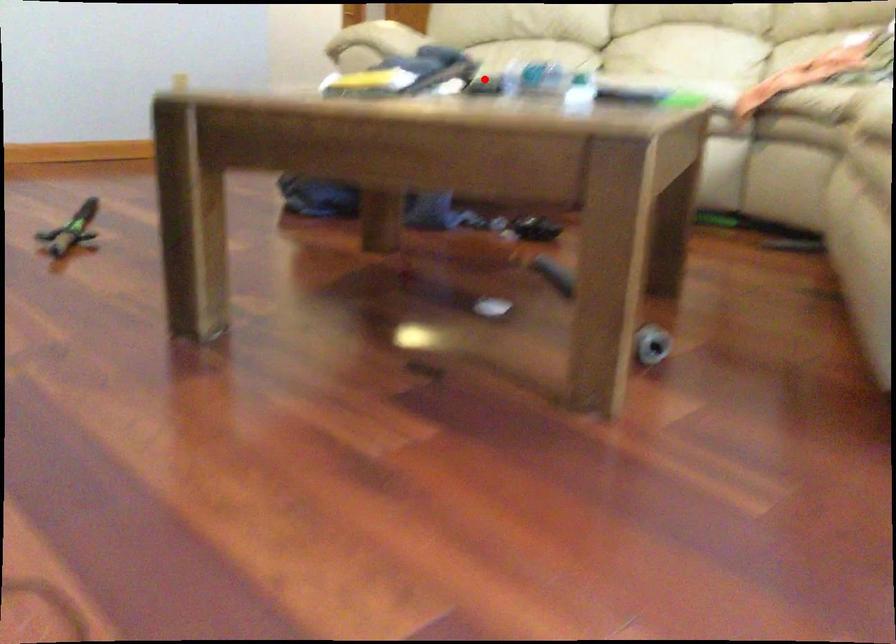
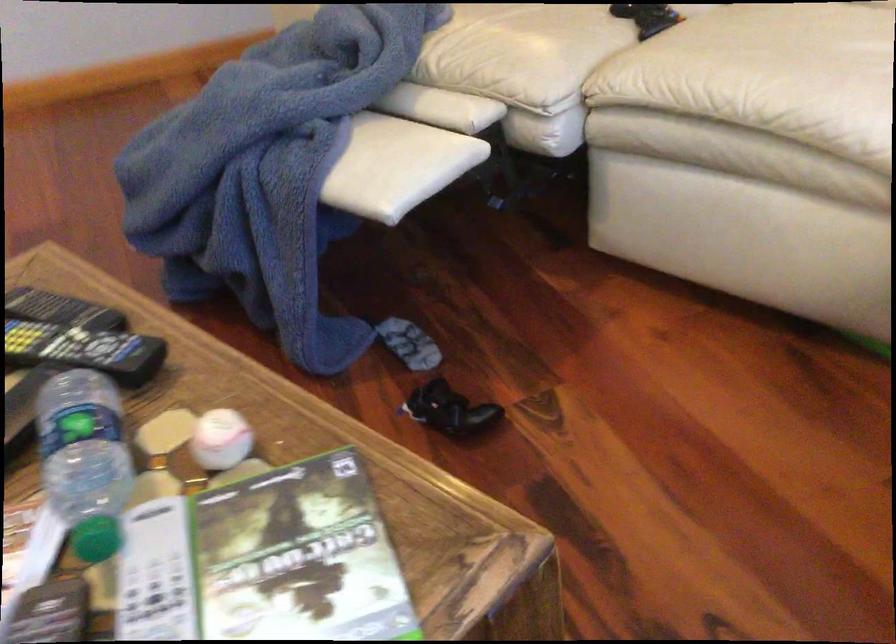
Question: I am providing you with two images of the same scene from different viewpoints. In image1, a red point is highlighted. Considering the same 3D point in image2, which of the following is correct?

Choices:
 (A) It is closer
 (B) It is farther

Answer: (A)